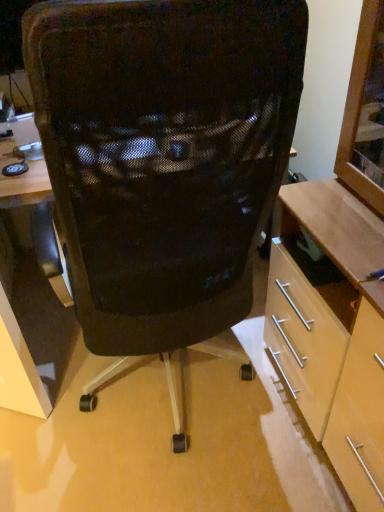
Question: Considering the positions of light wood cabinet at right and black mesh chair at center in the image, is light wood cabinet at right bigger or smaller than black mesh chair at center?

Choices:
 (A) small
 (B) big

Answer: (A)

Question: Is light wood cabinet at right to the left or to the right of black mesh chair at center in the image?

Choices:
 (A) left
 (B) right

Answer: (B)

Question: From their relative heights in the image, would you say light wood cabinet at right is taller or shorter than black mesh chair at center?

Choices:
 (A) short
 (B) tall

Answer: (A)

Question: From the image's perspective, is black mesh chair at center positioned above or below light wood cabinet at right?

Choices:
 (A) above
 (B) below

Answer: (A)

Question: Looking at their shapes, would you say black mesh chair at center is wider or thinner than light wood cabinet at right?

Choices:
 (A) wide
 (B) thin

Answer: (A)

Question: From a real-world perspective, relative to light wood cabinet at right, is black mesh chair at center vertically above or below?

Choices:
 (A) above
 (B) below

Answer: (B)

Question: In the image, is black mesh chair at center positioned in front of or behind light wood cabinet at right?

Choices:
 (A) front
 (B) behind

Answer: (B)